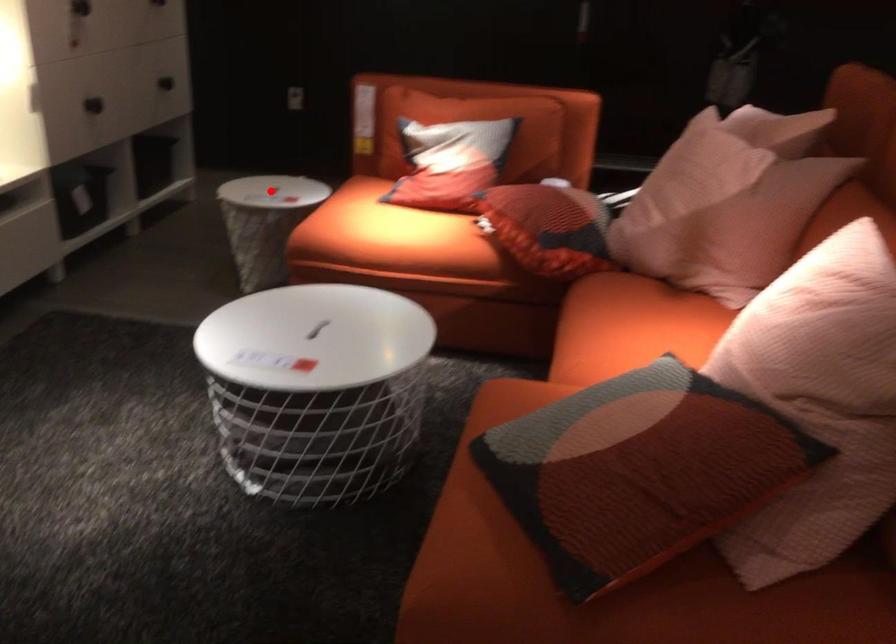
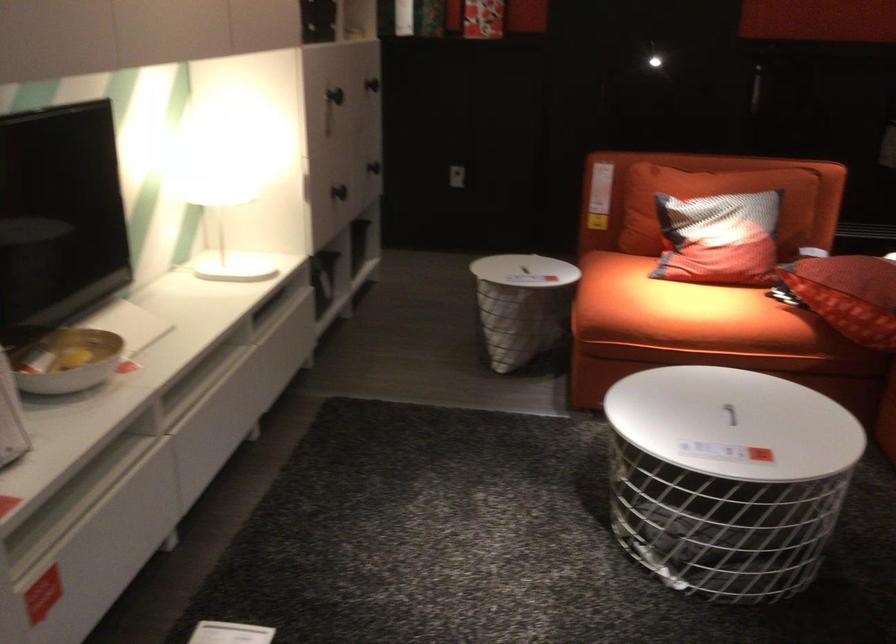
Question: I am providing you with two images of the same scene from different viewpoints. A red point is marked on the first image. Can you still see the location of the red point in image 2?

Choices:
 (A) Yes
 (B) No

Answer: (A)